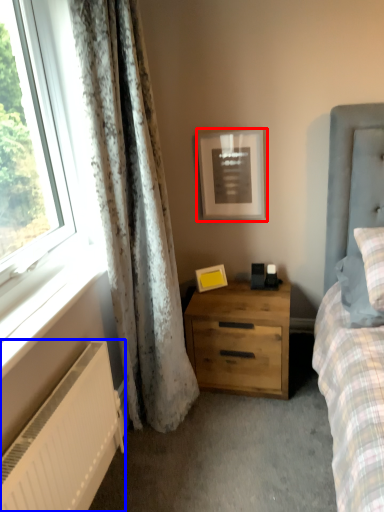
Question: Among these objects, which one is nearest to the camera, picture frame (highlighted by a red box) or radiator (highlighted by a blue box)?

Choices:
 (A) picture frame
 (B) radiator

Answer: (B)